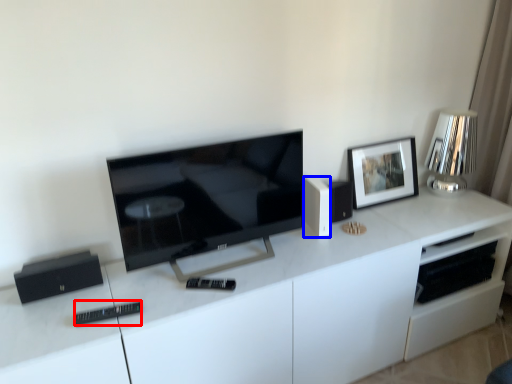
Question: Which object is further to the camera taking this photo, remote (highlighted by a red box) or speaker (highlighted by a blue box)?

Choices:
 (A) remote
 (B) speaker

Answer: (B)